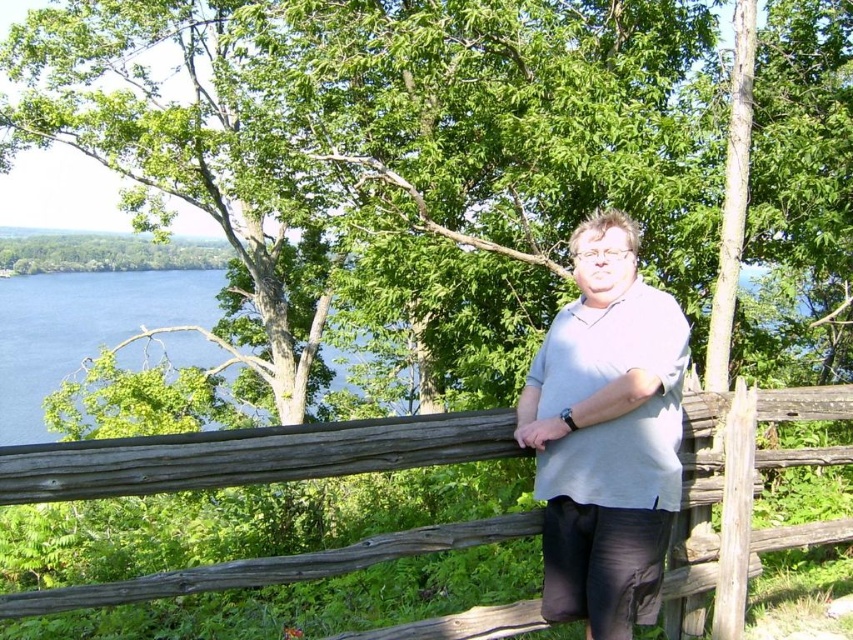
You are a painter who wants to paint the weathered wood fence at center. You noticed a specific point on the fence at coordinates point (245, 456). Where exactly is this point located on the fence?

The point (245, 456) is located on the weathered wood fence at center.

You are a photographer trying to capture the person in the light gray cotton shirt at center and the blue liquid water at left. Which object is closer to the camera based on their positions?

The light gray cotton shirt at center is positioned under the blue liquid water at left, meaning it is closer to the camera.